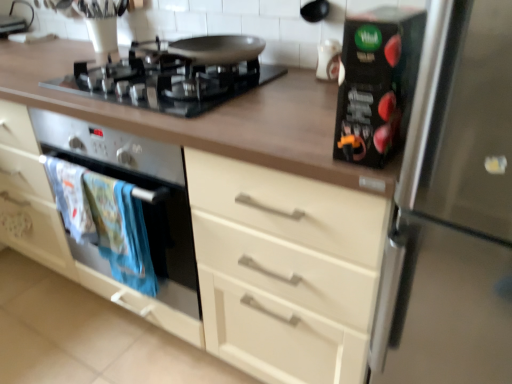
Image resolution: width=512 pixels, height=384 pixels. What are the coordinates of `vacant space situated on the left part of black glossy box at upper right, which ranks as the 1th appliance in bottom-to-top order` in the screenshot? It's located at (291, 140).